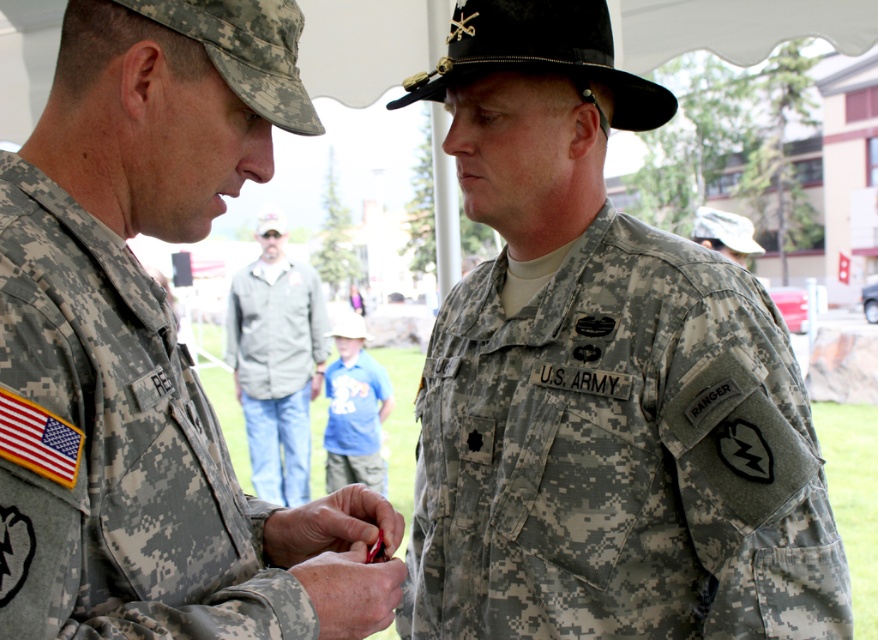
Which is in front, point (533, 524) or point (279, 260)?

Point (533, 524)

Which of these two, camouflage fabric us army uniform at center or gray fabric jacket at center, stands shorter?

Standing shorter between the two is camouflage fabric us army uniform at center.

Which is behind, point (635, 266) or point (270, 323)?

The point (270, 323) is more distant.

This screenshot has height=640, width=878. I want to click on camouflage fabric us army uniform at center, so click(619, 456).

Who is positioned more to the right, gray fabric jacket at center or blue cotton shirt at center?

Positioned to the right is blue cotton shirt at center.

Does gray fabric jacket at center appear over blue cotton shirt at center?

Indeed, gray fabric jacket at center is positioned over blue cotton shirt at center.

The width and height of the screenshot is (878, 640). Find the location of `gray fabric jacket at center`. gray fabric jacket at center is located at coordinates (276, 360).

This screenshot has width=878, height=640. In order to click on gray fabric jacket at center in this screenshot , I will do `click(276, 360)`.

Does camouflage fabric uniform at left come behind gray fabric jacket at center?

No, it is not.

Who is higher up, camouflage fabric uniform at left or gray fabric jacket at center?

gray fabric jacket at center is higher up.

Does point (51, 348) lie behind point (235, 292)?

No, it is not.

Where is `camouflage fabric uniform at left`? This screenshot has height=640, width=878. camouflage fabric uniform at left is located at coordinates (117, 451).